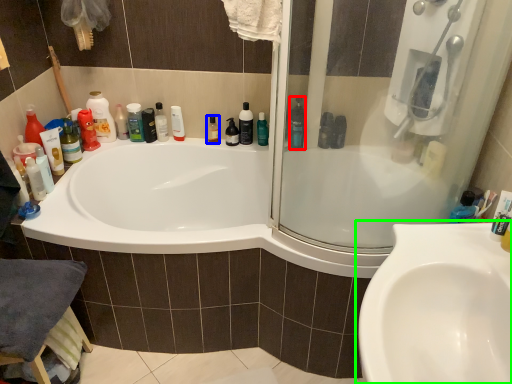
Question: Which is nearer to the cleaning product (highlighted by a red box)? mouthwash (highlighted by a blue box) or sink (highlighted by a green box).

Choices:
 (A) mouthwash
 (B) sink

Answer: (B)